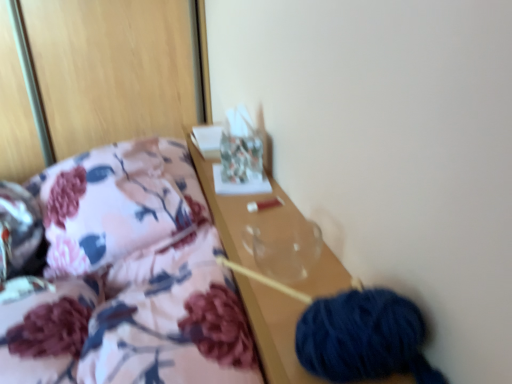
Find the location of a particular element. This screenshot has height=384, width=512. floral fabric at left is located at coordinates (170, 319).

Image resolution: width=512 pixels, height=384 pixels. Describe the element at coordinates (284, 247) in the screenshot. I see `transparent glass vase at center` at that location.

What do you see at coordinates (362, 337) in the screenshot? This screenshot has height=384, width=512. I see `dark blue yarn at lower right` at bounding box center [362, 337].

The image size is (512, 384). In order to click on floral fabric at left in this screenshot , I will do `click(170, 319)`.

Looking at this image, considering the relative sizes of floral fabric pillow at left and floral fabric at left in the image provided, is floral fabric pillow at left bigger than floral fabric at left?

Indeed, floral fabric pillow at left has a larger size compared to floral fabric at left.

Image resolution: width=512 pixels, height=384 pixels. Find the location of `throw pillow that appears behind the floral fabric at left`. throw pillow that appears behind the floral fabric at left is located at coordinates (115, 202).

Considering the positions of points (104, 180) and (174, 245), is point (104, 180) closer to camera compared to point (174, 245)?

Yes, it is.

From the image's perspective, would you say floral fabric pillow at left is shown under floral fabric at left?

Actually, floral fabric pillow at left appears above floral fabric at left in the image.

Looking at this image, can you confirm if floral fabric at left is positioned to the right of transparent glass vase at center?

In fact, floral fabric at left is to the left of transparent glass vase at center.

Where is `glass vase positioned vertically above the floral fabric at left (from a real-world perspective)`? glass vase positioned vertically above the floral fabric at left (from a real-world perspective) is located at coordinates pos(284,247).

Which of these two, floral fabric at left or transparent glass vase at center, is thinner?

With smaller width is transparent glass vase at center.

Is floral fabric at left taller than transparent glass vase at center?

Yes, floral fabric at left is taller than transparent glass vase at center.

From the picture: Is floral fabric pillow at left completely or partially outside of dark blue yarn at lower right?

Yes, floral fabric pillow at left is located beyond the bounds of dark blue yarn at lower right.

Consider the image. Could you tell me if floral fabric pillow at left is facing dark blue yarn at lower right?

No, floral fabric pillow at left does not turn towards dark blue yarn at lower right.

Which object is more forward, floral fabric pillow at left or dark blue yarn at lower right?

dark blue yarn at lower right.

In the scene shown: Between floral fabric pillow at left and transparent glass vase at center, which one is positioned in front?

transparent glass vase at center is in front.

Is floral fabric pillow at left located outside transparent glass vase at center?

Yes, floral fabric pillow at left is not within transparent glass vase at center.

In order to click on glass vase on the right of floral fabric pillow at left in this screenshot , I will do `click(284, 247)`.

Can you confirm if floral fabric pillow at left is positioned to the left of transparent glass vase at center?

Correct, you'll find floral fabric pillow at left to the left of transparent glass vase at center.

Between transparent glass vase at center and floral fabric pillow at left, which one appears on the left side from the viewer's perspective?

floral fabric pillow at left.

Is transparent glass vase at center thinner than floral fabric pillow at left?

Yes, transparent glass vase at center is thinner than floral fabric pillow at left.

Would you say transparent glass vase at center contains floral fabric pillow at left?

Actually, floral fabric pillow at left is outside transparent glass vase at center.

From a real-world perspective, which is physically below, transparent glass vase at center or floral fabric pillow at left?

floral fabric pillow at left is physically lower.

Considering the relative positions of dark blue yarn at lower right and floral fabric at left in the image provided, is dark blue yarn at lower right to the left or to the right of floral fabric at left?

dark blue yarn at lower right is positioned on floral fabric at left's right side.

In the scene shown: From a real-world perspective, is dark blue yarn at lower right under floral fabric at left?

No.

From the image's perspective, between dark blue yarn at lower right and floral fabric at left, which one is located above?

dark blue yarn at lower right, from the image's perspective.

Is dark blue yarn at lower right not inside floral fabric at left?

Yes.

Are dark blue yarn at lower right and floral fabric pillow at left far apart?

No, dark blue yarn at lower right is not far from floral fabric pillow at left.

From a real-world perspective, is dark blue yarn at lower right physically located above or below floral fabric pillow at left?

dark blue yarn at lower right is situated higher than floral fabric pillow at left in the real world.

Considering the positions of point (402, 299) and point (178, 186), is point (402, 299) closer or farther from the camera than point (178, 186)?

Point (402, 299) is positioned closer to the camera compared to point (178, 186).

Is dark blue yarn at lower right in front of floral fabric pillow at left?

Yes, dark blue yarn at lower right is in front of floral fabric pillow at left.

You are a GUI agent. You are given a task and a screenshot of the screen. Output one action in this format:
    pyautogui.click(x=<x>, y=<y>)
    Task: Click on the quilt on the right of floral fabric pillow at left
    The width and height of the screenshot is (512, 384).
    Given the screenshot: What is the action you would take?
    pyautogui.click(x=170, y=319)

The width and height of the screenshot is (512, 384). Find the location of `glass vase that is above the floral fabric at left (from a real-world perspective)`. glass vase that is above the floral fabric at left (from a real-world perspective) is located at coordinates (284, 247).

Which object lies further to the anchor point floral fabric at left, floral fabric pillow at left or dark blue yarn at lower right?

dark blue yarn at lower right is further to floral fabric at left.

Based on their spatial positions, is transparent glass vase at center or dark blue yarn at lower right further from floral fabric at left?

dark blue yarn at lower right lies further to floral fabric at left than the other object.

Which object lies nearer to the anchor point floral fabric at left, transparent glass vase at center or floral fabric pillow at left?

transparent glass vase at center is positioned closer to the anchor floral fabric at left.

Looking at the image, which one is located further to floral fabric pillow at left, transparent glass vase at center or dark blue yarn at lower right?

dark blue yarn at lower right.

When comparing their distances from floral fabric at left, does dark blue yarn at lower right or floral fabric pillow at left seem further?

dark blue yarn at lower right is positioned further to the anchor floral fabric at left.

Which object lies nearer to the anchor point dark blue yarn at lower right, floral fabric pillow at left or floral fabric at left?

floral fabric at left lies closer to dark blue yarn at lower right than the other object.

From the picture: When comparing their distances from floral fabric pillow at left, does transparent glass vase at center or floral fabric at left seem closer?

The object closer to floral fabric pillow at left is floral fabric at left.

Based on the photo, considering their positions, is floral fabric at left positioned closer to transparent glass vase at center than dark blue yarn at lower right?

floral fabric at left is positioned closer to the anchor transparent glass vase at center.

Locate an element on the screen. glass vase situated between floral fabric pillow at left and dark blue yarn at lower right from left to right is located at coordinates (284, 247).

Locate an element on the screen. This screenshot has width=512, height=384. quilt between floral fabric pillow at left and transparent glass vase at center from left to right is located at coordinates (170, 319).

This screenshot has height=384, width=512. Find the location of `glass vase between floral fabric at left and dark blue yarn at lower right`. glass vase between floral fabric at left and dark blue yarn at lower right is located at coordinates (284, 247).

You are a GUI agent. You are given a task and a screenshot of the screen. Output one action in this format:
    pyautogui.click(x=<x>, y=<y>)
    Task: Click on the quilt located between floral fabric pillow at left and dark blue yarn at lower right in the left-right direction
    The image size is (512, 384).
    Given the screenshot: What is the action you would take?
    pyautogui.click(x=170, y=319)